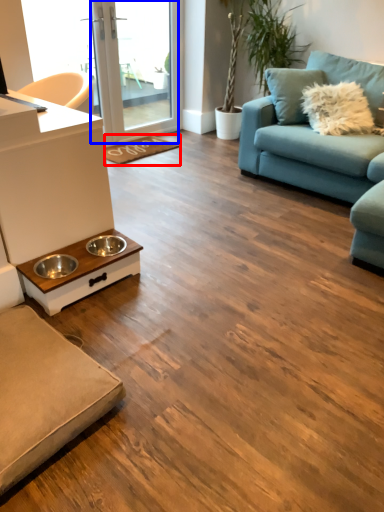
Question: Which of the following is the closest to the observer, doormat (highlighted by a red box) or screen door (highlighted by a blue box)?

Choices:
 (A) doormat
 (B) screen door

Answer: (B)